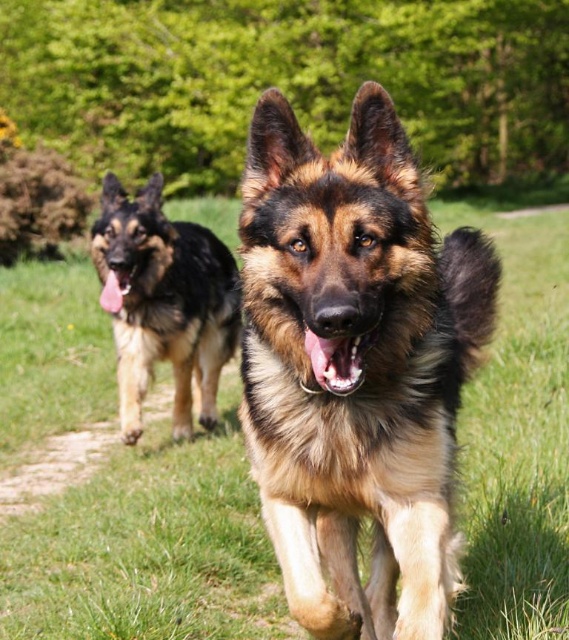
You are standing at the camera position and want to throw a ball to the point marked as point [170,483]. If your throwing range is 15 feet, will you be able to reach that point?

The distance between point [170,483] and the camera is 15.93 feet, which exceeds your throwing range of 15 feet. Therefore, you cannot reach that point.

You are standing at the origin point of the coordinate system. You want to throw a ball to the brown soft grass at center. In which direction should you throw the ball to reach the grass?

The brown soft grass at center is located at coordinate point 0.858 on the x axis and 0.262 on the y axis. Since you are at the origin, you should throw the ball towards the positive x and positive y direction to reach the grass.